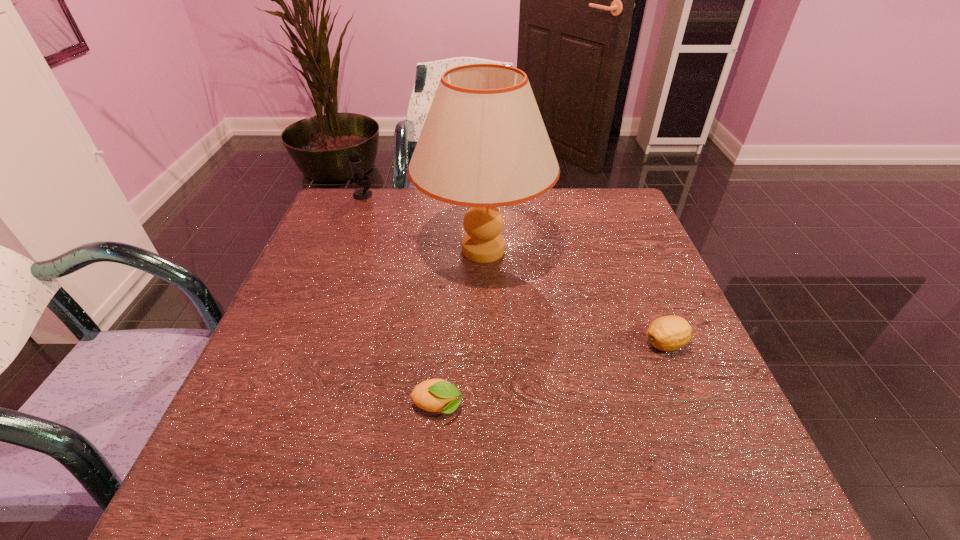
Locate an element on the screen. The height and width of the screenshot is (540, 960). vacant space at the left edge is located at coordinates (280, 359).

Where is `free space at the right edge`? free space at the right edge is located at coordinates (652, 256).

Where is `vacant space at the far left corner of the desktop`? This screenshot has height=540, width=960. vacant space at the far left corner of the desktop is located at coordinates (337, 203).

The height and width of the screenshot is (540, 960). Find the location of `vacant area at the near left corner of the desktop`. vacant area at the near left corner of the desktop is located at coordinates (275, 498).

Identify the location of free space at the far right corner of the desktop. (587, 190).

Locate an element on the screen. The width and height of the screenshot is (960, 540). vacant point located between the farther lemon and the leftmost object is located at coordinates coord(515,269).

What are the coordinates of `free space between the nearest object and the farther lemon` in the screenshot? It's located at (552, 375).

You are a GUI agent. You are given a task and a screenshot of the screen. Output one action in this format:
    pyautogui.click(x=<x>, y=<y>)
    Task: Click on the empty location between the farthest object and the second farthest object
    The height and width of the screenshot is (540, 960).
    Given the screenshot: What is the action you would take?
    pyautogui.click(x=423, y=222)

The height and width of the screenshot is (540, 960). Identify the location of empty location between the lampshade and the right lemon. (574, 297).

Find the location of a particular element. Image resolution: width=960 pixels, height=540 pixels. free area in between the lampshade and the nearer lemon is located at coordinates (461, 328).